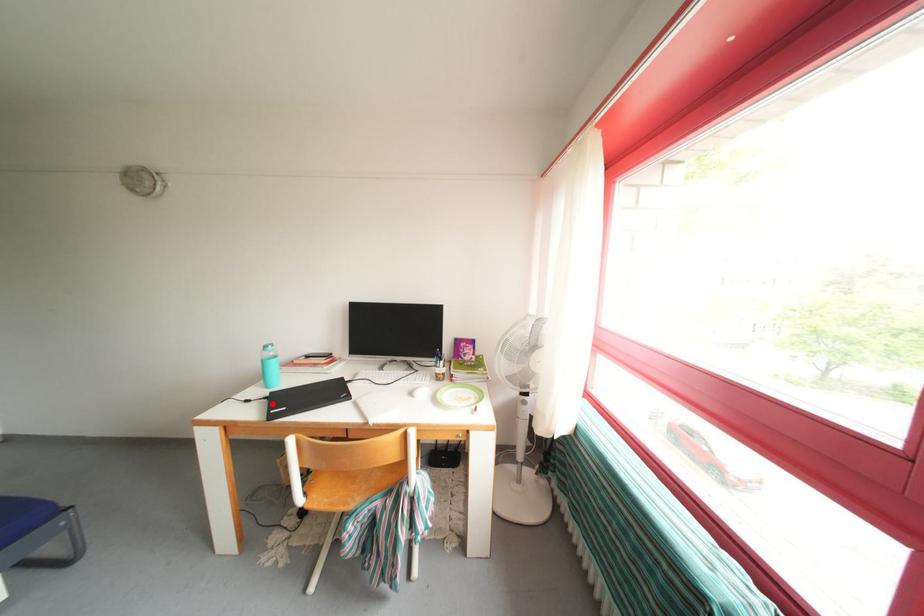
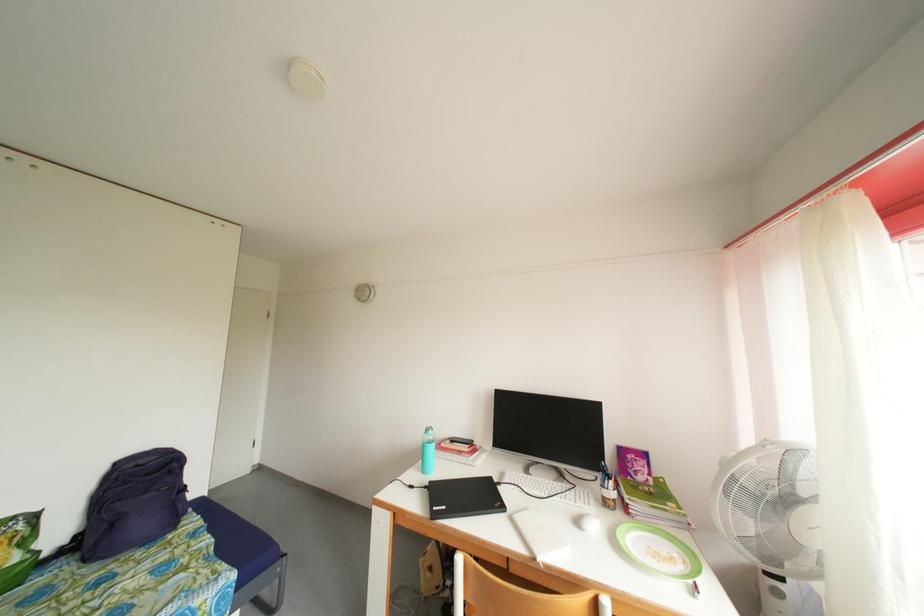
Find the pixel in the second image that matches the highlighted location in the first image.

(432, 493)